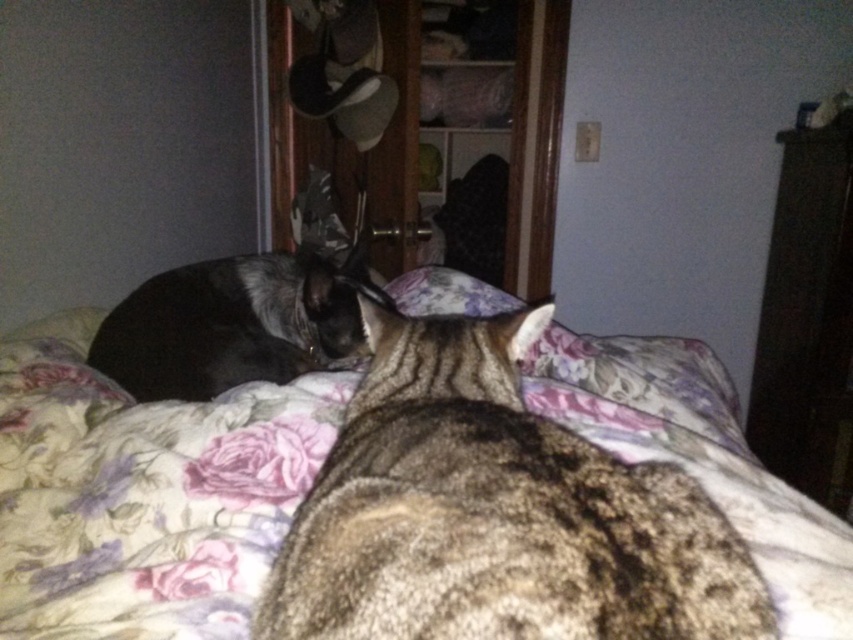
You are trying to decide whether to place a new rectangular decorative item on the dark wood dresser at right or on the tabby fur at left. Based on their widths, which surface would be more suitable for the item?

The tabby fur at left has a greater width than the dark wood dresser at right, so the tabby fur at left would be more suitable for placing the rectangular decorative item.

You are a cat owner who wants to ensure your cats have enough space to sleep comfortably. Given the scene described, can the tabby fur at left fit on the floral fabric bed at center without overcrowding?

The floral fabric bed at center is bigger than the tabby fur at left, so there should be enough space for the tabby fur at left to rest comfortably without overcrowding.

You are a cat owner trying to locate your cats on the bed. Based on the scene, where is the tabby fur at left in relation to the floral fabric bed at center?

The tabby fur at left is above the floral fabric bed at center because the bed is located below it.